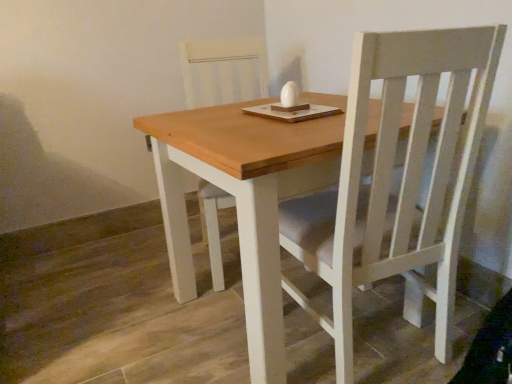
Describe the element at coordinates (223, 71) in the screenshot. I see `white wood chair at center` at that location.

Measure the distance between white wood chair at center and camera.

white wood chair at center and camera are 6.29 feet apart.

Where is `white wood chair at center`? This screenshot has height=384, width=512. white wood chair at center is located at coordinates (223, 71).

Where is `wooden table at center`? The width and height of the screenshot is (512, 384). wooden table at center is located at coordinates [239, 182].

What do you see at coordinates (239, 182) in the screenshot? The width and height of the screenshot is (512, 384). I see `wooden table at center` at bounding box center [239, 182].

Find the location of a particular element. This screenshot has width=512, height=384. white wood chair at center is located at coordinates (223, 71).

Is wooden table at center to the left of white wood chair at center from the viewer's perspective?

No.

Considering the positions of objects wooden table at center and white wood chair at center in the image provided, who is in front, wooden table at center or white wood chair at center?

wooden table at center is more forward.

Between point (285, 162) and point (238, 92), which one is positioned behind?

The point (238, 92) is more distant.

From the image's perspective, is wooden table at center on top of white wood chair at center?

Incorrect, from the image's perspective, wooden table at center is lower than white wood chair at center.

From a real-world perspective, does wooden table at center stand above white wood chair at center?

Incorrect, from a real-world perspective, wooden table at center is lower than white wood chair at center.

Considering the sizes of objects wooden table at center and white wood chair at center in the image provided, who is wider, wooden table at center or white wood chair at center?

wooden table at center is wider.

Which of these two, wooden table at center or white wood chair at center, stands shorter?

wooden table at center.

Considering the sizes of objects wooden table at center and white wood chair at center in the image provided, who is smaller, wooden table at center or white wood chair at center?

Smaller between the two is white wood chair at center.

Is wooden table at center outside of white wood chair at center?

Indeed, wooden table at center is completely outside white wood chair at center.

Is the surface of wooden table at center in direct contact with white wood chair at center?

No, wooden table at center is not with white wood chair at center.

Could you tell me if wooden table at center is facing white wood chair at center?

No, wooden table at center is not turned towards white wood chair at center.

Find the location of a particular element. The width and height of the screenshot is (512, 384). round table that is in front of the white wood chair at center is located at coordinates (239, 182).

Between white wood chair at center and wooden table at center, which one appears on the left side from the viewer's perspective?

white wood chair at center.

In the image, is white wood chair at center positioned in front of or behind wooden table at center?

Visually, white wood chair at center is located behind wooden table at center.

Which is closer to the camera, (194, 98) or (320, 101)?

Point (320, 101)

From the image's perspective, is white wood chair at center under wooden table at center?

No, from the image's perspective, white wood chair at center is not beneath wooden table at center.

From a real-world perspective, is white wood chair at center under wooden table at center?

No.

In terms of width, does white wood chair at center look wider or thinner when compared to wooden table at center?

In the image, white wood chair at center appears to be more narrow than wooden table at center.

Looking at this image, from their relative heights in the image, would you say white wood chair at center is taller or shorter than wooden table at center?

Considering their sizes, white wood chair at center has more height than wooden table at center.

Is white wood chair at center bigger than wooden table at center?

No, white wood chair at center is not bigger than wooden table at center.

Can we say white wood chair at center lies outside wooden table at center?

No, white wood chair at center is inside wooden table at center's boundary.

Is white wood chair at center far from wooden table at center?

No.

Does white wood chair at center turn towards wooden table at center?

Yes.

In the scene shown: How different are the orientations of white wood chair at center and wooden table at center in degrees?

They differ by 14.6 degrees in their facing directions.

You are a GUI agent. You are given a task and a screenshot of the screen. Output one action in this format:
    pyautogui.click(x=<x>, y=<y>)
    Task: Click on the round table directly beneath the white wood chair at center (from a real-world perspective)
    The image size is (512, 384).
    Given the screenshot: What is the action you would take?
    pyautogui.click(x=239, y=182)

Identify the location of chair located above the wooden table at center (from the image's perspective). The height and width of the screenshot is (384, 512). (223, 71).

Locate an element on the screen. The image size is (512, 384). round table in front of the white wood chair at center is located at coordinates (239, 182).